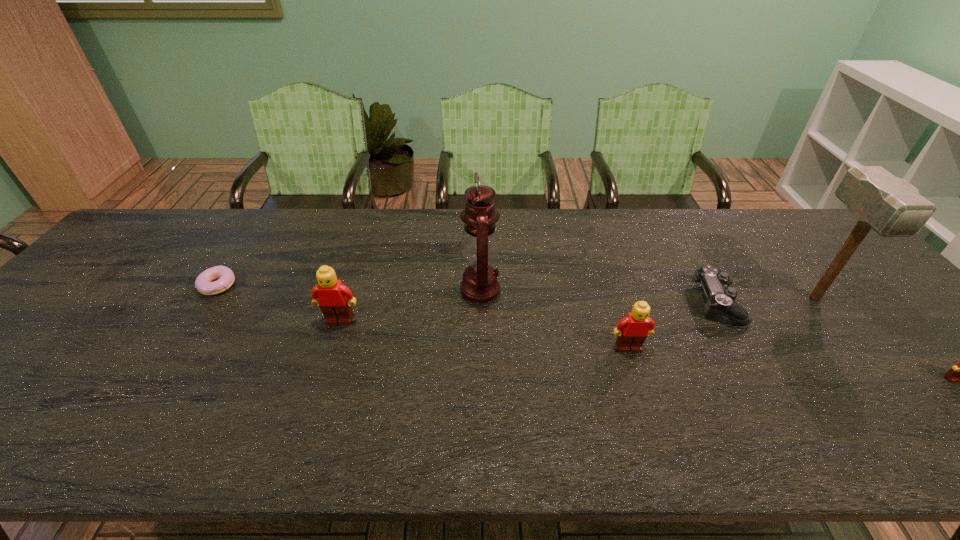
Identify the location of vacant space at the far left corner of the desktop. (145, 230).

You are a GUI agent. You are given a task and a screenshot of the screen. Output one action in this format:
    pyautogui.click(x=<x>, y=<y>)
    Task: Click on the blank area at the far right corner
    This screenshot has width=960, height=540.
    Given the screenshot: What is the action you would take?
    pyautogui.click(x=779, y=215)

Locate an element on the screen. free spot at the near right corner of the desktop is located at coordinates (919, 388).

Where is `free area in between the farthest Lego and the second shortest object`? free area in between the farthest Lego and the second shortest object is located at coordinates (529, 312).

This screenshot has height=540, width=960. Identify the location of empty space between the second tallest Lego and the oil lamp. (554, 319).

The height and width of the screenshot is (540, 960). Find the location of `empty location between the leftmost object and the mallet`. empty location between the leftmost object and the mallet is located at coordinates (516, 292).

You are a GUI agent. You are given a task and a screenshot of the screen. Output one action in this format:
    pyautogui.click(x=<x>, y=<y>)
    Task: Click on the free space between the second Lego from left to right and the shortest object
    The width and height of the screenshot is (960, 540).
    Given the screenshot: What is the action you would take?
    pyautogui.click(x=422, y=317)

Find the location of a particular element. free spot between the third object from right to left and the second object from right to left is located at coordinates (766, 300).

You are a GUI agent. You are given a task and a screenshot of the screen. Output one action in this format:
    pyautogui.click(x=<x>, y=<y>)
    Task: Click on the free point between the shortest object and the third object from left to right
    
    Given the screenshot: What is the action you would take?
    pyautogui.click(x=348, y=287)

Point out which object is positioned as the second nearest to the nearest object. Please provide its 2D coordinates. Your answer should be formatted as a tuple, i.e. [(x, y)], where the tuple contains the x and y coordinates of a point satisfying the conditions above.

[(721, 299)]